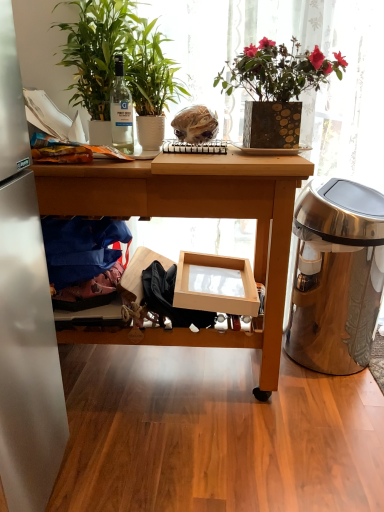
Question: From the image's perspective, is translucent plastic bag at center located beneath blue fabric at left?

Choices:
 (A) yes
 (B) no

Answer: (B)

Question: Is translucent plastic bag at center looking in the opposite direction of blue fabric at left?

Choices:
 (A) no
 (B) yes

Answer: (A)

Question: From the image's perspective, is translucent plastic bag at center on top of blue fabric at left?

Choices:
 (A) no
 (B) yes

Answer: (B)

Question: Does translucent plastic bag at center come behind blue fabric at left?

Choices:
 (A) yes
 (B) no

Answer: (A)

Question: Is translucent plastic bag at center smaller than blue fabric at left?

Choices:
 (A) no
 (B) yes

Answer: (B)

Question: From the image's perspective, is green matte plant at left, which ranks as the 1th houseplant in left-to-right order, located above or below green glossy plant at upper left, which is the second houseplant in left-to-right order?

Choices:
 (A) above
 (B) below

Answer: (A)

Question: Looking at their shapes, would you say green matte plant at left, which ranks as the 1th houseplant in left-to-right order, is wider or thinner than green glossy plant at upper left, the 1th houseplant in the right-to-left sequence?

Choices:
 (A) wide
 (B) thin

Answer: (A)

Question: Is green matte plant at left, the second houseplant viewed from the right, inside or outside of green glossy plant at upper left, which is the second houseplant in left-to-right order?

Choices:
 (A) outside
 (B) inside

Answer: (A)

Question: Considering the relative positions of green matte plant at left, the second houseplant viewed from the right, and green glossy plant at upper left, which is the second houseplant in left-to-right order, in the image provided, is green matte plant at left, the second houseplant viewed from the right, to the left or to the right of green glossy plant at upper left, which is the second houseplant in left-to-right order,?

Choices:
 (A) left
 (B) right

Answer: (A)

Question: Is stainless steel trash can at right taller or shorter than clear glass bottle at upper left?

Choices:
 (A) short
 (B) tall

Answer: (B)

Question: Considering the relative positions of stainless steel trash can at right and clear glass bottle at upper left in the image provided, is stainless steel trash can at right to the left or to the right of clear glass bottle at upper left?

Choices:
 (A) left
 (B) right

Answer: (B)

Question: From a real-world perspective, is stainless steel trash can at right positioned above or below clear glass bottle at upper left?

Choices:
 (A) above
 (B) below

Answer: (B)

Question: Is stainless steel trash can at right situated inside clear glass bottle at upper left or outside?

Choices:
 (A) outside
 (B) inside

Answer: (A)

Question: Is green matte plant at left, the second houseplant viewed from the right, wider or thinner than stainless steel trash can at right?

Choices:
 (A) thin
 (B) wide

Answer: (B)

Question: From the image's perspective, is green matte plant at left, which ranks as the 1th houseplant in left-to-right order, positioned above or below stainless steel trash can at right?

Choices:
 (A) below
 (B) above

Answer: (B)